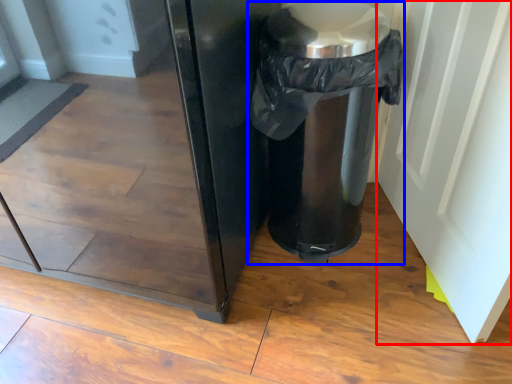
Question: Which of the following is the closest to the observer, screen door (highlighted by a red box) or waste container (highlighted by a blue box)?

Choices:
 (A) screen door
 (B) waste container

Answer: (A)